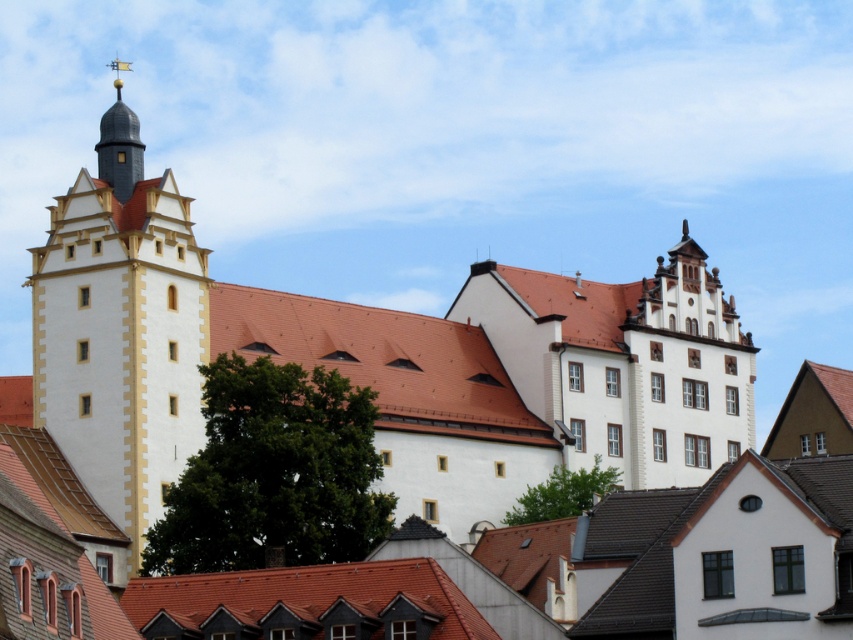
You are standing in front of the historic building complex. You notice the white matte building at center and the matte white tower at left. Which of these two structures is positioned lower in the scene?

The white matte building at center is positioned lower than the matte white tower at left in the scene.

You are standing at the entrance of the historic area and want to take a photo of the white matte building at center. According to the coordinates provided, where should you position yourself to ensure the building is centered in your camera frame?

To center the white matte building at center in your camera frame, position yourself at the coordinates provided, which are point (379, 365).

You are a tourist standing in front of the historic building. You want to take a photo of the shiny gold spire at upper left without the matte white tower at left blocking it. Is this possible?

The matte white tower at left is in front of the shiny gold spire at upper left, so it will block the view of the spire. You need to move to a different angle where the tower is not obstructing the spire.